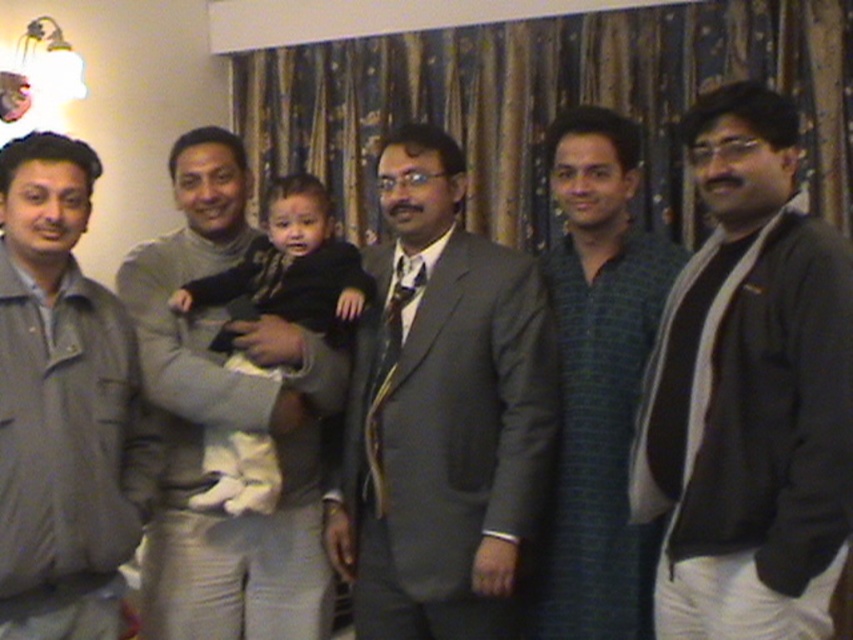
You are organizing a photo shoot and need to arrange the subjects based on their clothing length. Given the dark gray sweater at right and the green striped shirt at center, which clothing item should be placed in a position that requires shorter length?

The dark gray sweater at right should be placed in the position requiring shorter length since it is shorter than the green striped shirt at center.

You are standing in the room and want to hand a gift to the person wearing the dark gray sweater at right and the person wearing the green striped shirt at center. Which one can you reach without moving closer?

The dark gray sweater at right is closer to the viewer than the green striped shirt at center, so you can reach the person wearing the dark gray sweater at right without moving closer.

You are planning to buy a new jacket and want to know which one is wider between the matte gray suit at center and the gray fabric jacket at left. Based on the image, which one is wider?

The matte gray suit at center is wider than the gray fabric jacket at left according to the description.